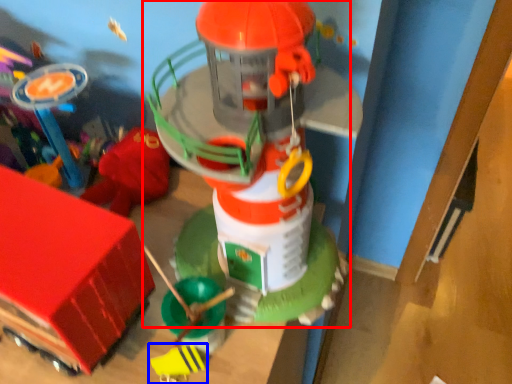
Question: Which of the following is the farthest to the observer, toy (highlighted by a red box) or toy (highlighted by a blue box)?

Choices:
 (A) toy
 (B) toy

Answer: (B)